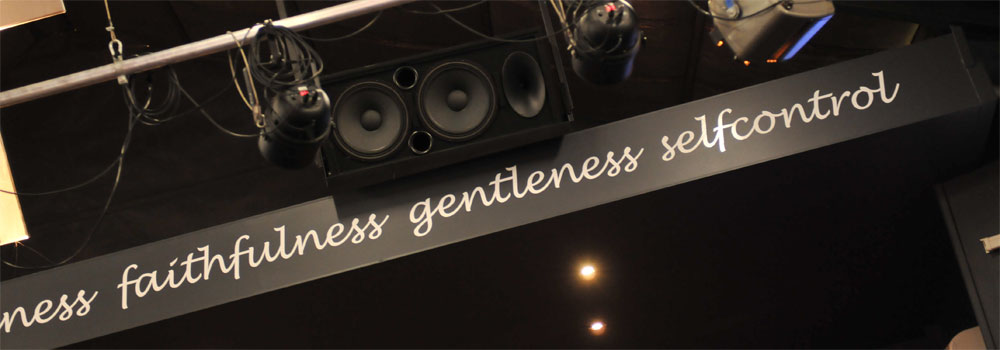
Find the location of a particular element. Image resolution: width=1000 pixels, height=350 pixels. hook is located at coordinates (114, 41).